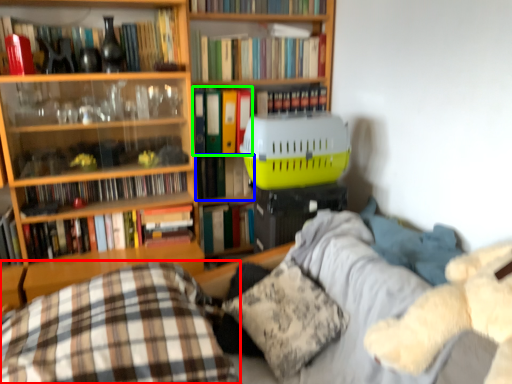
Question: Estimate the real-world distances between objects in this image. Which object is closer to pillow (highlighted by a red box), book (highlighted by a blue box) or book (highlighted by a green box)?

Choices:
 (A) book
 (B) book

Answer: (A)